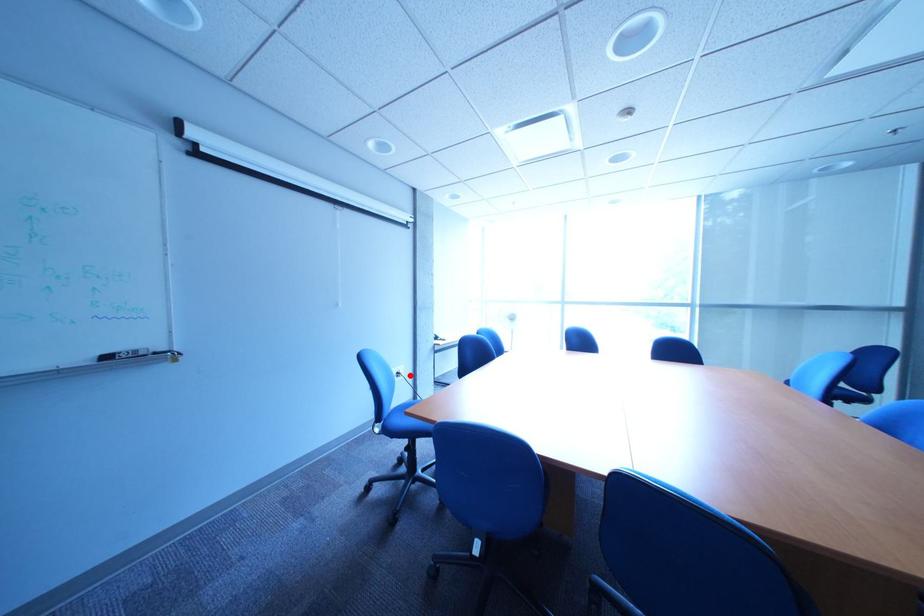
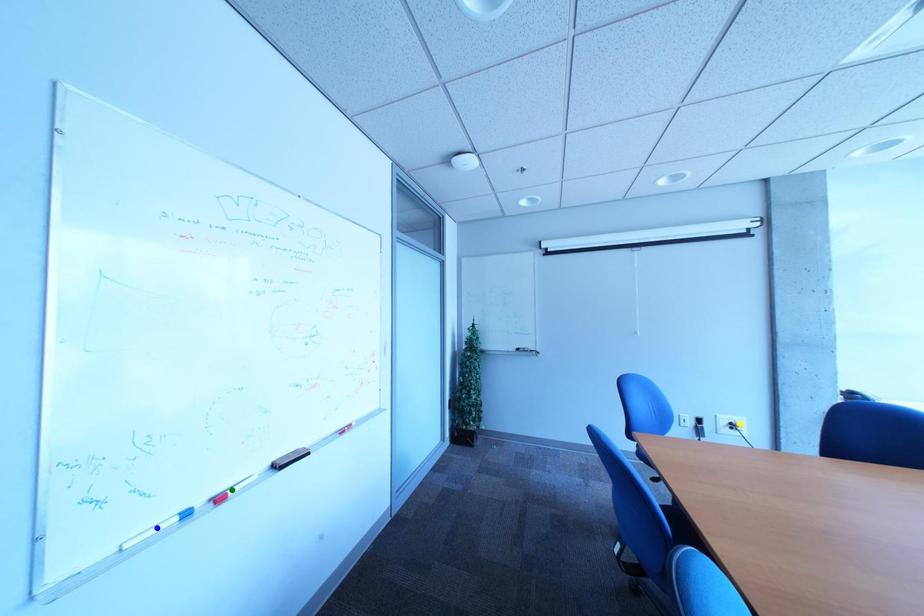
Question: I am providing you with two images of the same scene from different viewpoints. A red point is marked on the first image. You are given multiple points on the second image. In image 2, which mark is for the same physical point as the one in image 1?

Choices:
 (A) blue point
 (B) yellow point
 (C) green point

Answer: (B)